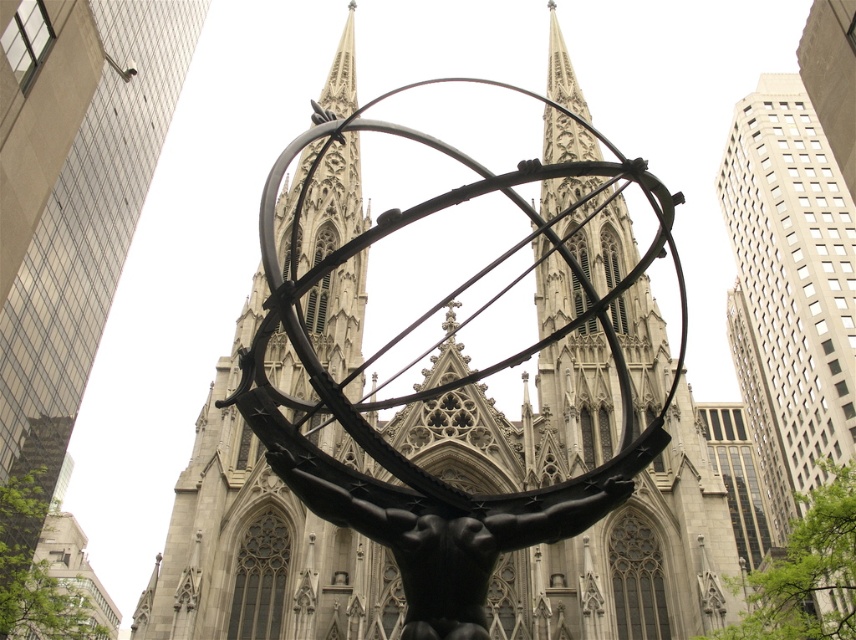
You are an architect planning to install a new pathway between the polished bronze atlas at center and the black polished statue at center. The pathway requires a minimum of 100 feet of space. Based on the scene, will the available space between them be sufficient?

The distance between the polished bronze atlas at center and the black polished statue at center is 96.99 feet, which is less than the required 100 feet. Therefore, the available space is insufficient for the pathway.